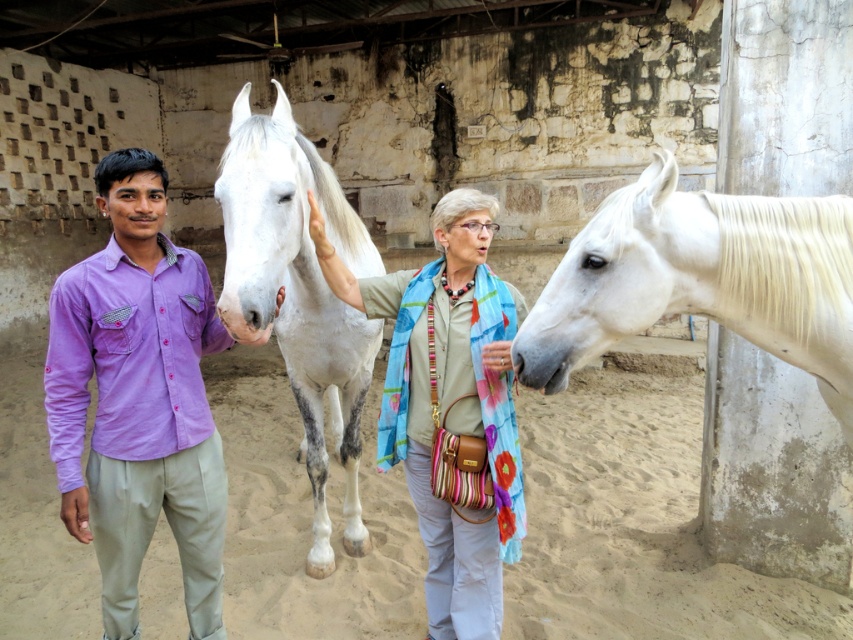
Question: Which object appears farthest from the camera in this image?

Choices:
 (A) white glossy horse at right
 (B) purple cotton shirt at left
 (C) light beige scarf at center
 (D) white speckled fur at center

Answer: (C)

Question: Which object is farther from the camera taking this photo?

Choices:
 (A) purple cotton shirt at left
 (B) light beige scarf at center
 (C) white speckled fur at center

Answer: (B)

Question: Among these points, which one is nearest to the camera?

Choices:
 (A) (747, 314)
 (B) (430, 316)

Answer: (A)

Question: Does purple cotton shirt at left appear over light beige scarf at center?

Choices:
 (A) yes
 (B) no

Answer: (A)

Question: Is light beige scarf at center wider than white speckled fur at center?

Choices:
 (A) yes
 (B) no

Answer: (A)

Question: Can you confirm if purple cotton shirt at left is bigger than light beige scarf at center?

Choices:
 (A) no
 (B) yes

Answer: (A)